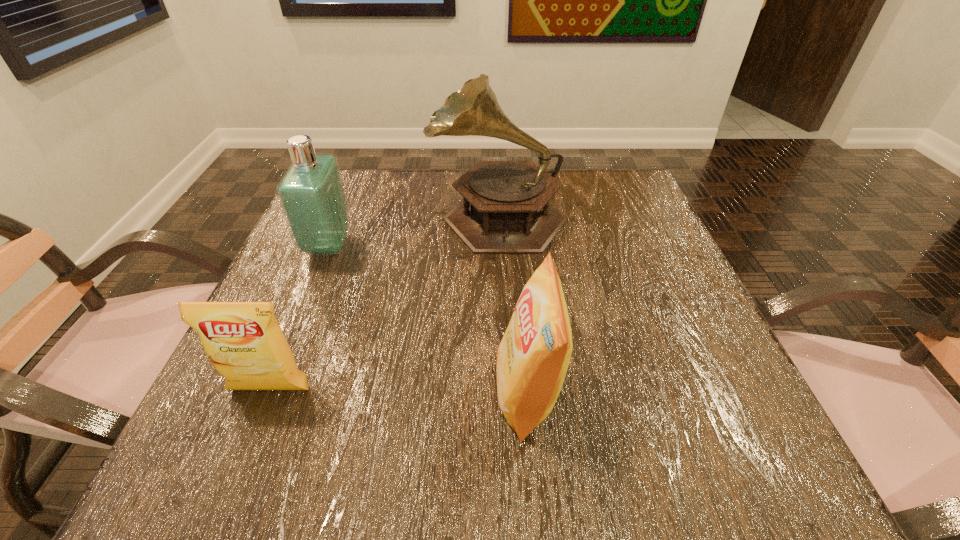
I want to click on vacant area located on the front-facing side of the right crisp (potato chip), so click(324, 394).

The image size is (960, 540). What are the coordinates of `vacant area situated on the front of the left crisp (potato chip) with the logo` in the screenshot? It's located at (239, 468).

The image size is (960, 540). In order to click on object located in the far edge section of the desktop in this screenshot , I will do `click(505, 209)`.

This screenshot has width=960, height=540. I want to click on object present at the near edge, so click(533, 356).

I want to click on perfume present at the left edge, so click(x=311, y=193).

Where is `crisp (potato chip) located at the left edge`? This screenshot has height=540, width=960. crisp (potato chip) located at the left edge is located at coordinates (243, 340).

Locate an element on the screen. This screenshot has height=540, width=960. free spot at the far edge of the desktop is located at coordinates (430, 212).

This screenshot has height=540, width=960. What are the coordinates of `vacant area at the near edge` in the screenshot? It's located at (480, 427).

The height and width of the screenshot is (540, 960). Find the location of `vacant space at the left edge of the desktop`. vacant space at the left edge of the desktop is located at coordinates (303, 264).

Locate an element on the screen. free space at the right edge of the desktop is located at coordinates (624, 322).